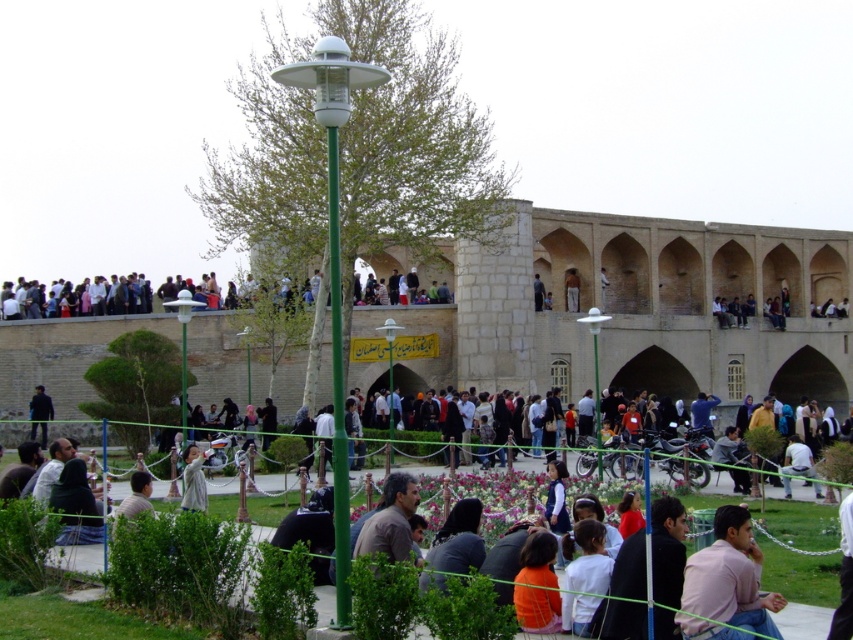
You are a tourist standing at the base of the historical structure and see the multicolored clothing at upper center and the light brown wooden pole at upper center. Which object is higher in the scene?

The multicolored clothing at upper center is positioned over the light brown wooden pole at upper center, so it is higher in the scene.